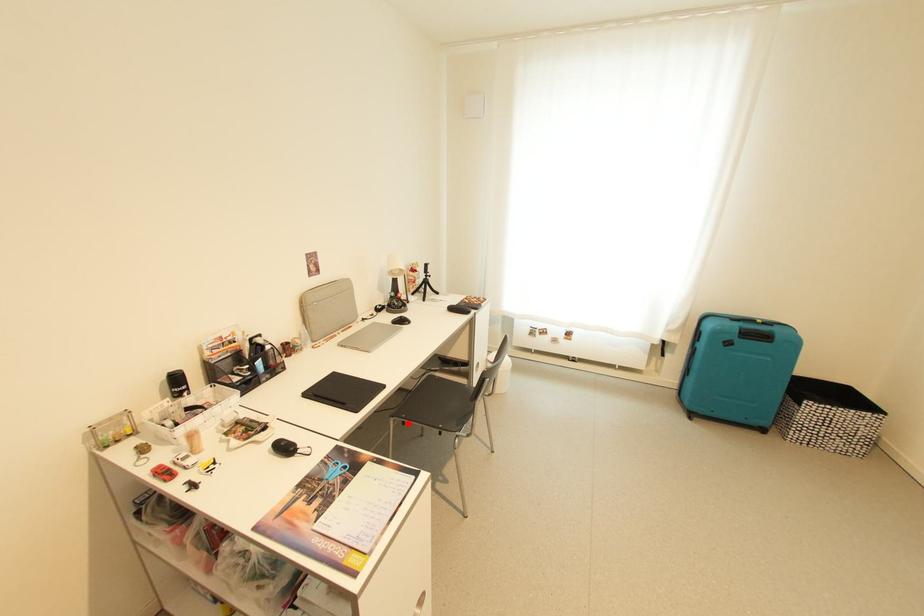
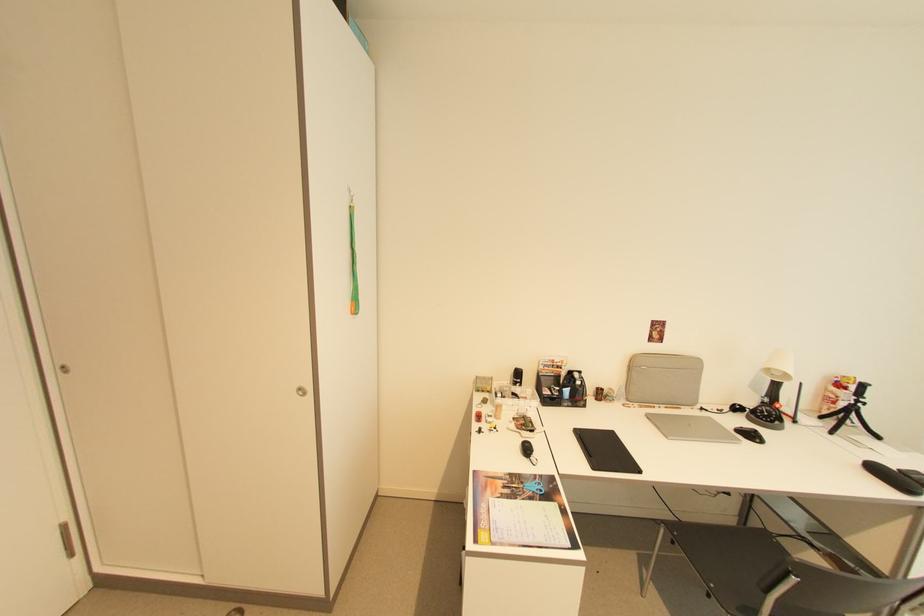
The point at the highlighted location is marked in the first image. Where is the corresponding point in the second image?

(677, 541)